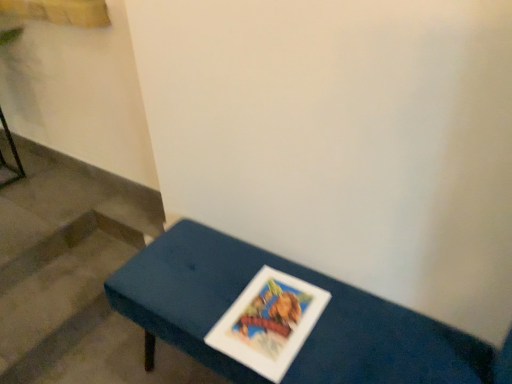
The height and width of the screenshot is (384, 512). Describe the element at coordinates (312, 331) in the screenshot. I see `blue fabric bench at center` at that location.

What are the coordinates of `wooden stairs at lower left` in the screenshot? It's located at (59, 292).

Find the location of a particular element. metallic black stool at left is located at coordinates (13, 155).

Which object is positioned more to the right, wooden stairs at lower left or metallic black stool at left?

From the viewer's perspective, wooden stairs at lower left appears more on the right side.

Consider the image. Does wooden stairs at lower left have a lesser height compared to metallic black stool at left?

Yes, wooden stairs at lower left is shorter than metallic black stool at left.

This screenshot has height=384, width=512. Find the location of `stairwell below the metallic black stool at left (from a real-world perspective)`. stairwell below the metallic black stool at left (from a real-world perspective) is located at coordinates (59, 292).

Who is bigger, wooden stairs at lower left or metallic black stool at left?

wooden stairs at lower left is bigger.

Does blue fabric bench at center touch wooden stairs at lower left?

No, blue fabric bench at center is not with wooden stairs at lower left.

Measure the distance between blue fabric bench at center and wooden stairs at lower left.

The distance of blue fabric bench at center from wooden stairs at lower left is 24.44 inches.

Which is closer, (357,352) or (104,227)?

Point (357,352) is positioned closer to the camera compared to point (104,227).

Looking at this image, how many degrees apart are the facing directions of blue fabric bench at center and wooden stairs at lower left?

The angular difference between blue fabric bench at center and wooden stairs at lower left is 88.3 degrees.

Are wooden stairs at lower left and blue fabric bench at center far apart?

No, wooden stairs at lower left is not far from blue fabric bench at center.

At what (x,y) coordinates should I click in order to perform the action: click on table positioned vertically above the wooden stairs at lower left (from a real-world perspective). Please return your answer as a coordinate pair (x, y). Looking at the image, I should click on (312, 331).

Is wooden stairs at lower left located outside blue fabric bench at center?

That's correct, wooden stairs at lower left is outside of blue fabric bench at center.

Based on the photo, measure the distance from wooden stairs at lower left to blue fabric bench at center.

A distance of 62.07 centimeters exists between wooden stairs at lower left and blue fabric bench at center.

From a real-world perspective, which is physically above, metallic black stool at left or wooden stairs at lower left?

metallic black stool at left.

Which point is more forward, (x=10, y=147) or (x=74, y=339)?

The point (x=74, y=339) is in front.

Could you tell me if metallic black stool at left is facing wooden stairs at lower left?

No, metallic black stool at left is not oriented towards wooden stairs at lower left.

Find the location of a particular element. stairwell that appears on the right of metallic black stool at left is located at coordinates point(59,292).

Looking at this image, from the image's perspective, which is above, metallic black stool at left or blue fabric bench at center?

metallic black stool at left.

Can you confirm if metallic black stool at left is shorter than blue fabric bench at center?

Correct, metallic black stool at left is not as tall as blue fabric bench at center.

Is metallic black stool at left positioned with its back to blue fabric bench at center?

No, metallic black stool at left is not facing away from blue fabric bench at center.

From the image's perspective, is blue fabric bench at center on metallic black stool at left?

No, from the image's perspective, blue fabric bench at center is not over metallic black stool at left.

Is blue fabric bench at center smaller than metallic black stool at left?

Actually, blue fabric bench at center might be larger than metallic black stool at left.

Is blue fabric bench at center facing towards metallic black stool at left?

No, blue fabric bench at center is not turned towards metallic black stool at left.

Is blue fabric bench at center wider or thinner than metallic black stool at left?

Clearly, blue fabric bench at center has more width compared to metallic black stool at left.

Locate an element on the screen. stairwell below the metallic black stool at left (from a real-world perspective) is located at coordinates (59, 292).

The width and height of the screenshot is (512, 384). In the image, there is a blue fabric bench at center. Find the location of `stairwell above it (from the image's perspective)`. stairwell above it (from the image's perspective) is located at coordinates (59, 292).

Looking at the image, which one is located further to blue fabric bench at center, wooden stairs at lower left or metallic black stool at left?

metallic black stool at left.

Estimate the real-world distances between objects in this image. Which object is further from metallic black stool at left, wooden stairs at lower left or blue fabric bench at center?

Among the two, blue fabric bench at center is located further to metallic black stool at left.

Which object lies nearer to the anchor point blue fabric bench at center, metallic black stool at left or wooden stairs at lower left?

wooden stairs at lower left is closer to blue fabric bench at center.

From the picture: Estimate the real-world distances between objects in this image. Which object is further from wooden stairs at lower left, blue fabric bench at center or metallic black stool at left?

Among the two, metallic black stool at left is located further to wooden stairs at lower left.

When comparing their distances from wooden stairs at lower left, does metallic black stool at left or blue fabric bench at center seem further?

metallic black stool at left is further to wooden stairs at lower left.

Which object lies nearer to the anchor point metallic black stool at left, blue fabric bench at center or wooden stairs at lower left?

Among the two, wooden stairs at lower left is located nearer to metallic black stool at left.

Identify the location of stairwell located between metallic black stool at left and blue fabric bench at center in the left-right direction. (59, 292).